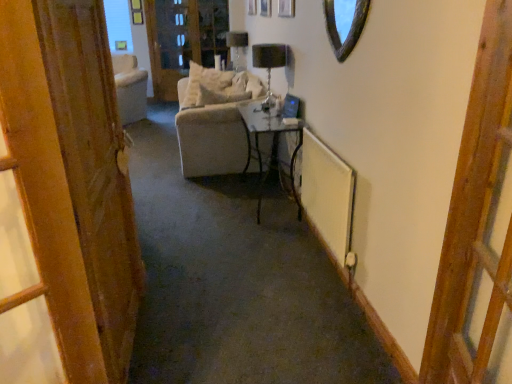
What do you see at coordinates (204, 84) in the screenshot? The image size is (512, 384). I see `white soft pillow at center` at bounding box center [204, 84].

In order to face white fabric screen door at upper center, should I rotate leftwards or rightwards?

To align with it, rotate left about 8.657°.

Identify the location of white fabric screen door at upper center. [183, 39].

You are a GUI agent. You are given a task and a screenshot of the screen. Output one action in this format:
    pyautogui.click(x=<x>, y=<y>)
    Task: Click on the metallic black table at center
    Image resolution: width=512 pixels, height=384 pixels.
    Given the screenshot: What is the action you would take?
    pyautogui.click(x=274, y=132)

What is the approximate width of metallic black table at center?

metallic black table at center is 15.39 inches in width.

This screenshot has width=512, height=384. Describe the element at coordinates (345, 24) in the screenshot. I see `shiny glass mirror at upper center` at that location.

Locate an element on the screen. The image size is (512, 384). wooden at right is located at coordinates (475, 214).

From a real-world perspective, which is physically below, white fabric screen door at upper center or white soft pillow at center?

white soft pillow at center is physically lower.

Is white fabric screen door at upper center facing away from white soft pillow at center?

That's not correct — white fabric screen door at upper center is not looking away from white soft pillow at center.

Which is correct: black glass lamp at center, which is counted as the first lamp, starting from the right, is inside wooden at right, or outside of it?

black glass lamp at center, which is counted as the first lamp, starting from the right, is outside wooden at right.

Is black glass lamp at center, which ranks as the second lamp in left-to-right order, touching wooden at right?

black glass lamp at center, which ranks as the second lamp in left-to-right order, and wooden at right are not in contact.

Is wooden at right at the back of black glass lamp at center, which is counted as the first lamp, starting from the right?

No.

How many degrees apart are the facing directions of black glass lamp at center, which appears as the 2th lamp when viewed from the back, and wooden at right?

19.2 degrees.

Could you measure the distance between wooden door at left and black glass lamp at center, arranged as the second lamp when viewed from the top?

wooden door at left is 7.38 feet away from black glass lamp at center, arranged as the second lamp when viewed from the top.

From a real-world perspective, is wooden door at left positioned above or below black glass lamp at center, placed as the first lamp when sorted from bottom to top?

wooden door at left is situated lower than black glass lamp at center, placed as the first lamp when sorted from bottom to top, in the real world.

Is wooden door at left far away from black glass lamp at center, acting as the 1th lamp starting from the front?

Yes, wooden door at left and black glass lamp at center, acting as the 1th lamp starting from the front, are quite far apart.

Consider the image. Is wooden door at left wider or thinner than black glass lamp at center, which ranks as the second lamp in left-to-right order?

Clearly, wooden door at left has less width compared to black glass lamp at center, which ranks as the second lamp in left-to-right order.

Is wooden door at left bigger than metallic black table at center?

Incorrect, wooden door at left is not larger than metallic black table at center.

Is wooden door at left in front of or behind metallic black table at center in the image?

wooden door at left is in front of metallic black table at center.

Is point (33, 6) farther from camera compared to point (265, 132)?

No, (33, 6) is closer to viewer.

Is metallic black table at center located within wooden door at left?

No, wooden door at left does not contain metallic black table at center.

From a real-world perspective, is white matte radiator at right physically below shiny glass mirror at upper center?

Yes, from a real-world perspective, white matte radiator at right is below shiny glass mirror at upper center.

Is white matte radiator at right far away from shiny glass mirror at upper center?

No, there isn't a large distance between white matte radiator at right and shiny glass mirror at upper center.

Considering the positions of objects white matte radiator at right and shiny glass mirror at upper center in the image provided, who is more to the right, white matte radiator at right or shiny glass mirror at upper center?

shiny glass mirror at upper center is more to the right.

Does white matte radiator at right have a lesser height compared to shiny glass mirror at upper center?

In fact, white matte radiator at right may be taller than shiny glass mirror at upper center.

Between matte black lampshade at upper center, which is the 1th lamp from top to bottom, and metallic black table at center, which one has smaller size?

matte black lampshade at upper center, which is the 1th lamp from top to bottom, is smaller.

Consider the image. Which object is more forward, matte black lampshade at upper center, the 2th lamp in the front-to-back sequence, or metallic black table at center?

metallic black table at center is more forward.

Between point (240, 63) and point (292, 158), which one is positioned behind?

The point (240, 63) is more distant.

Locate an element on the screen. lamp on the left of metallic black table at center is located at coordinates (237, 49).

Is matte black lampshade at upper center, the 2th lamp in the front-to-back sequence, positioned behind shiny glass mirror at upper center?

That is True.

Can we say matte black lampshade at upper center, the first lamp positioned from the back, lies outside shiny glass mirror at upper center?

matte black lampshade at upper center, the first lamp positioned from the back, lies outside shiny glass mirror at upper center's area.

In the scene shown: Between matte black lampshade at upper center, the first lamp positioned from the back, and shiny glass mirror at upper center, which one has more height?

matte black lampshade at upper center, the first lamp positioned from the back, is taller.

From a real-world perspective, is matte black lampshade at upper center, which appears as the 1th lamp when viewed from the left, on shiny glass mirror at upper center?

No, from a real-world perspective, matte black lampshade at upper center, which appears as the 1th lamp when viewed from the left, is not on top of shiny glass mirror at upper center.

This screenshot has width=512, height=384. Identify the location of screen door to the left of white soft pillow at center. (183, 39).

Identify the location of lamp that is the 1st object above the wooden at right (from a real-world perspective). This screenshot has width=512, height=384. click(269, 64).

When comparing their distances from black glass lamp at center, which ranks as the second lamp in left-to-right order, does white matte radiator at right or wooden at right seem closer?

white matte radiator at right lies closer to black glass lamp at center, which ranks as the second lamp in left-to-right order, than the other object.

Which object lies further to the anchor point black glass lamp at center, which ranks as the second lamp in left-to-right order, wooden door at left or shiny glass mirror at upper center?

wooden door at left lies further to black glass lamp at center, which ranks as the second lamp in left-to-right order, than the other object.

Estimate the real-world distances between objects in this image. Which object is further from metallic black table at center, white fabric screen door at upper center or wooden at right?

white fabric screen door at upper center lies further to metallic black table at center than the other object.

Which object lies nearer to the anchor point shiny glass mirror at upper center, white matte radiator at right or wooden door at left?

Among the two, white matte radiator at right is located nearer to shiny glass mirror at upper center.

Considering their positions, is white soft pillow at center positioned further to white matte radiator at right than white fabric screen door at upper center?

white fabric screen door at upper center lies further to white matte radiator at right than the other object.

Consider the image. From the image, which object appears to be nearer to shiny glass mirror at upper center, matte black lampshade at upper center, the 2th lamp in the front-to-back sequence, or white soft pillow at center?

Based on the image, white soft pillow at center appears to be nearer to shiny glass mirror at upper center.

Estimate the real-world distances between objects in this image. Which object is further from wooden at right, black glass lamp at center, placed as the first lamp when sorted from bottom to top, or white soft pillow at center?

Based on the image, white soft pillow at center appears to be further to wooden at right.

From the image, which object appears to be nearer to wooden at right, white soft pillow at center or wooden door at left?

wooden door at left.

The image size is (512, 384). Find the location of `pillow between white matte radiator at right and white fabric screen door at upper center from front to back`. pillow between white matte radiator at right and white fabric screen door at upper center from front to back is located at coordinates (204, 84).

Locate an element on the screen. The image size is (512, 384). pillow positioned between wooden at right and white fabric screen door at upper center from near to far is located at coordinates (204, 84).

Where is `mirror between wooden door at left and metallic black table at center in the front-back direction`? The height and width of the screenshot is (384, 512). mirror between wooden door at left and metallic black table at center in the front-back direction is located at coordinates (345, 24).

This screenshot has height=384, width=512. Find the location of `radiator between shiny glass mirror at upper center and metallic black table at center in the front-back direction`. radiator between shiny glass mirror at upper center and metallic black table at center in the front-back direction is located at coordinates (327, 194).